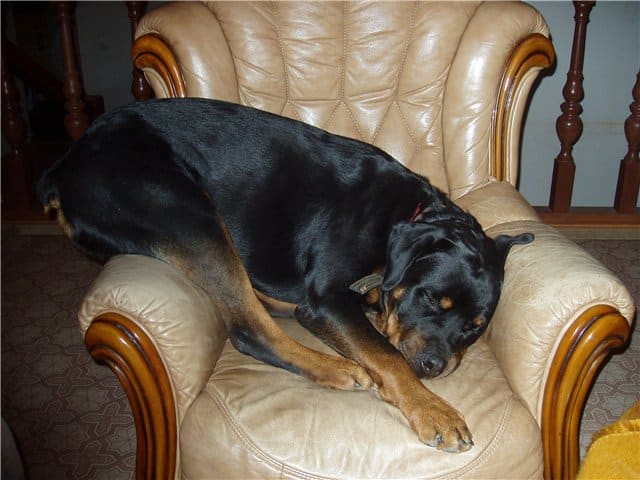
Find the location of a particular element. This screenshot has height=480, width=640. chair is located at coordinates (472, 406).